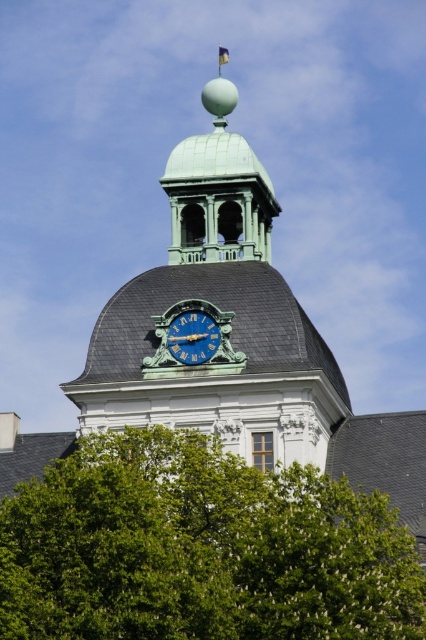
Question: Which point appears farthest from the camera in this image?

Choices:
 (A) (222, 481)
 (B) (221, 218)
 (C) (210, 355)
 (D) (279, 333)

Answer: (B)

Question: Can you confirm if green leafy tree at lower center is positioned above green polished dome at center?

Choices:
 (A) no
 (B) yes

Answer: (A)

Question: Is green polished dome at center bigger than blue metallic clock at center?

Choices:
 (A) no
 (B) yes

Answer: (B)

Question: Estimate the real-world distances between objects in this image. Which object is closer to the green leafy tree at lower center?

Choices:
 (A) green polished dome at center
 (B) blue metallic clock at center

Answer: (B)

Question: Which point appears closest to the camera in this image?

Choices:
 (A) (201, 264)
 (B) (193, 344)
 (C) (256, 161)

Answer: (B)

Question: Is green leafy tree at lower center further to the viewer compared to green polished dome at center?

Choices:
 (A) no
 (B) yes

Answer: (A)